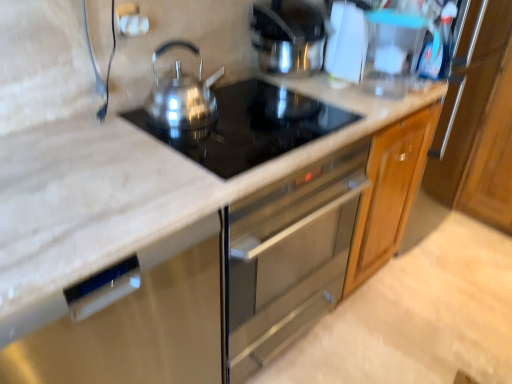
Find the location of `satin silver dishwasher at center`. satin silver dishwasher at center is located at coordinates (138, 324).

The image size is (512, 384). Describe the element at coordinates (288, 37) in the screenshot. I see `satin silver kettle at upper center, the second kitchen appliance viewed from the left` at that location.

You are a GUI agent. You are given a task and a screenshot of the screen. Output one action in this format:
    pyautogui.click(x=<x>, y=<y>)
    Task: Click on the black marble countertop at center
    
    Given the screenshot: What is the action you would take?
    pyautogui.click(x=192, y=235)

Considering the relative positions of transparent plastic pitcher at upper right and satin silver dishwasher at center in the image provided, is transparent plastic pitcher at upper right behind satin silver dishwasher at center?

Yes, transparent plastic pitcher at upper right is further from the camera.

Measure the distance between transparent plastic pitcher at upper right and satin silver dishwasher at center.

transparent plastic pitcher at upper right is 1.02 meters from satin silver dishwasher at center.

Is transparent plastic pitcher at upper right bigger or smaller than satin silver dishwasher at center?

transparent plastic pitcher at upper right is smaller than satin silver dishwasher at center.

Is transparent plastic pitcher at upper right thinner than satin silver dishwasher at center?

Indeed, transparent plastic pitcher at upper right has a lesser width compared to satin silver dishwasher at center.

From a real-world perspective, relative to transparent plastic pitcher at upper right, is satin silver kettle at center, which is the first kitchen appliance from left to right, vertically above or below?

satin silver kettle at center, which is the first kitchen appliance from left to right, is below transparent plastic pitcher at upper right.

Is satin silver kettle at center, which is the first kitchen appliance from left to right, in front of or behind transparent plastic pitcher at upper right in the image?

In the image, satin silver kettle at center, which is the first kitchen appliance from left to right, appears in front of transparent plastic pitcher at upper right.

From the image's perspective, is satin silver kettle at center, arranged as the 1th kitchen appliance when viewed from the front, under transparent plastic pitcher at upper right?

Yes, from the image's perspective, satin silver kettle at center, arranged as the 1th kitchen appliance when viewed from the front, is beneath transparent plastic pitcher at upper right.

Find the location of a particular element. The width and height of the screenshot is (512, 384). appliance on the right of satin silver kettle at upper center, the first kitchen appliance positioned from the right is located at coordinates (391, 51).

Is satin silver kettle at upper center, the second kitchen appliance viewed from the left, aimed at transparent plastic pitcher at upper right?

Yes.

Based on the photo, is satin silver kettle at upper center, which is the second kitchen appliance from front to back, far from transparent plastic pitcher at upper right?

They are positioned close to each other.

Does point (316, 18) appear closer or farther from the camera than point (389, 24)?

Clearly, point (316, 18) is more distant from the camera than point (389, 24).

Can you confirm if satin black cooktop at center is wider than satin silver kettle at center, which is the first kitchen appliance from left to right?

Indeed, satin black cooktop at center has a greater width compared to satin silver kettle at center, which is the first kitchen appliance from left to right.

Is satin black cooktop at center smaller than satin silver kettle at center, the second kitchen appliance in the back-to-front sequence?

Correct, satin black cooktop at center occupies less space than satin silver kettle at center, the second kitchen appliance in the back-to-front sequence.

Considering the relative positions of satin black cooktop at center and satin silver kettle at center, arranged as the 1th kitchen appliance when viewed from the front, in the image provided, is satin black cooktop at center to the left of satin silver kettle at center, arranged as the 1th kitchen appliance when viewed from the front, from the viewer's perspective?

No.

Is the surface of satin silver kettle at center, arranged as the 1th kitchen appliance when viewed from the front, in direct contact with black marble countertop at center?

satin silver kettle at center, arranged as the 1th kitchen appliance when viewed from the front, and black marble countertop at center are not in contact.

Is satin silver kettle at center, which is the first kitchen appliance from left to right, positioned with its back to black marble countertop at center?

satin silver kettle at center, which is the first kitchen appliance from left to right, is not turned away from black marble countertop at center.

Who is shorter, satin silver kettle at center, which is the first kitchen appliance from left to right, or black marble countertop at center?

satin silver kettle at center, which is the first kitchen appliance from left to right.

Between satin silver kettle at center, the second kitchen appliance in the back-to-front sequence, and black marble countertop at center, which one has larger width?

black marble countertop at center.

Which point is more distant from viewer, (x=151, y=89) or (x=297, y=128)?

Answer: Positioned behind is point (x=151, y=89).

Between satin silver kettle at center, which is the first kitchen appliance from left to right, and satin black cooktop at center, which one has smaller size?

With smaller size is satin black cooktop at center.

From a real-world perspective, is satin silver kettle at center, which is the first kitchen appliance from left to right, under satin black cooktop at center?

No.

How much distance is there between satin silver kettle at center, arranged as the 1th kitchen appliance when viewed from the front, and satin black cooktop at center?

They are 5.25 inches apart.

Considering the relative sizes of black marble countertop at center and satin silver dishwasher at center in the image provided, is black marble countertop at center wider than satin silver dishwasher at center?

No, black marble countertop at center is not wider than satin silver dishwasher at center.

Can you confirm if black marble countertop at center is smaller than satin silver dishwasher at center?

Indeed, black marble countertop at center has a smaller size compared to satin silver dishwasher at center.

Is black marble countertop at center facing away from satin silver dishwasher at center?

No, black marble countertop at center is not facing the opposite direction of satin silver dishwasher at center.

Find the location of a particular element. This screenshot has height=384, width=512. appliance on the right of satin silver dishwasher at center is located at coordinates (391, 51).

Identify the location of kitchen appliance that appears below the transparent plastic pitcher at upper right (from a real-world perspective). (182, 96).

Which object lies further to the anchor point transparent plastic pitcher at upper right, satin silver kettle at upper center, the 1th kitchen appliance in the back-to-front sequence, or satin silver kettle at center, which is the second kitchen appliance from right to left?

satin silver kettle at center, which is the second kitchen appliance from right to left, lies further to transparent plastic pitcher at upper right than the other object.

From the image, which object appears to be farther from satin silver kettle at upper center, the second kitchen appliance viewed from the left, satin silver dishwasher at center or satin black cooktop at center?

satin silver dishwasher at center.

Which object lies further to the anchor point black marble countertop at center, satin black cooktop at center or satin silver dishwasher at center?

Based on the image, satin black cooktop at center appears to be further to black marble countertop at center.

When comparing their distances from satin silver kettle at center, which is the first kitchen appliance from left to right, does satin silver dishwasher at center or black marble countertop at center seem closer?

black marble countertop at center is closer to satin silver kettle at center, which is the first kitchen appliance from left to right.

Consider the image. Estimate the real-world distances between objects in this image. Which object is closer to satin silver dishwasher at center, satin black cooktop at center or satin silver kettle at center, which is the second kitchen appliance from right to left?

satin black cooktop at center is closer to satin silver dishwasher at center.

Considering their positions, is satin black cooktop at center positioned further to satin silver kettle at center, the second kitchen appliance in the back-to-front sequence, than satin silver dishwasher at center?

satin silver dishwasher at center is further to satin silver kettle at center, the second kitchen appliance in the back-to-front sequence.

Which object lies nearer to the anchor point satin black cooktop at center, black marble countertop at center or satin silver kettle at upper center, which is the second kitchen appliance from front to back?

Based on the image, black marble countertop at center appears to be nearer to satin black cooktop at center.

Based on their spatial positions, is satin black cooktop at center or black marble countertop at center closer to satin silver dishwasher at center?

Among the two, black marble countertop at center is located nearer to satin silver dishwasher at center.

At what (x,y) coordinates should I click in order to perform the action: click on countertop between satin silver dishwasher at center and transparent plastic pitcher at upper right. Please return your answer as a coordinate pair (x, y). This screenshot has width=512, height=384. Looking at the image, I should click on (192, 235).

Locate an element on the screen. gas stove situated between satin silver kettle at center, arranged as the 1th kitchen appliance when viewed from the front, and transparent plastic pitcher at upper right from left to right is located at coordinates (251, 126).

Where is `countertop between satin silver kettle at center, the second kitchen appliance in the back-to-front sequence, and transparent plastic pitcher at upper right, in the horizontal direction`? The image size is (512, 384). countertop between satin silver kettle at center, the second kitchen appliance in the back-to-front sequence, and transparent plastic pitcher at upper right, in the horizontal direction is located at coordinates (192, 235).

You are a GUI agent. You are given a task and a screenshot of the screen. Output one action in this format:
    pyautogui.click(x=<x>, y=<y>)
    Task: Click on the appliance between satin silver kettle at upper center, the 1th kitchen appliance in the back-to-front sequence, and black marble countertop at center vertically
    
    Given the screenshot: What is the action you would take?
    pyautogui.click(x=391, y=51)